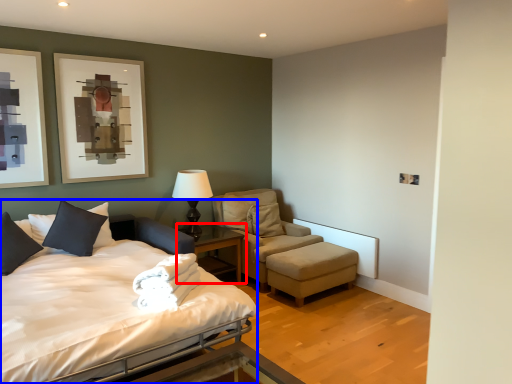
Question: Which object appears closest to the camera in this image, nightstand (highlighted by a red box) or bed (highlighted by a blue box)?

Choices:
 (A) nightstand
 (B) bed

Answer: (B)